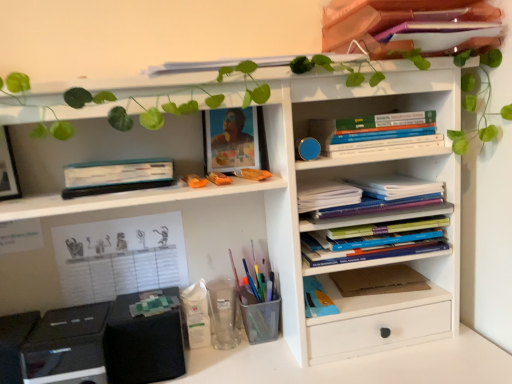
Question: Does matte plastic picture frame at upper center have a greater height compared to transparent plastic cup at lower center, which is the 2th stationery in left-to-right order?

Choices:
 (A) no
 (B) yes

Answer: (B)

Question: Can you confirm if matte plastic picture frame at upper center is smaller than transparent plastic cup at lower center, which is the 2th stationery in left-to-right order?

Choices:
 (A) yes
 (B) no

Answer: (B)

Question: From the image's perspective, is matte plastic picture frame at upper center on transparent plastic cup at lower center, which is the 2th stationery in left-to-right order?

Choices:
 (A) no
 (B) yes

Answer: (B)

Question: From a real-world perspective, is matte plastic picture frame at upper center physically below transparent plastic cup at lower center, which is the 2th stationery in left-to-right order?

Choices:
 (A) yes
 (B) no

Answer: (B)

Question: Is matte plastic picture frame at upper center outside transparent plastic cup at lower center, which is the 2th stationery in left-to-right order?

Choices:
 (A) no
 (B) yes

Answer: (B)

Question: Choose the correct answer: Is hardcover books at center right, the 1th book in the bottom-to-top sequence, inside transparent plastic cup at lower center, which is the 2th stationery from right to left, or outside it?

Choices:
 (A) outside
 (B) inside

Answer: (A)

Question: Does point (399, 206) appear closer or farther from the camera than point (225, 317)?

Choices:
 (A) farther
 (B) closer

Answer: (B)

Question: Considering the relative positions of hardcover books at center right, the 1th book in the bottom-to-top sequence, and transparent plastic cup at lower center, which is the 2th stationery in left-to-right order, in the image provided, is hardcover books at center right, the 1th book in the bottom-to-top sequence, to the left or to the right of transparent plastic cup at lower center, which is the 2th stationery in left-to-right order,?

Choices:
 (A) left
 (B) right

Answer: (B)

Question: From the image's perspective, is hardcover books at center right, the 1th book in the bottom-to-top sequence, above or below transparent plastic cup at lower center, which is the 2th stationery from right to left?

Choices:
 (A) below
 (B) above

Answer: (B)

Question: Is point (176, 266) closer or farther from the camera than point (398, 200)?

Choices:
 (A) closer
 (B) farther

Answer: (B)

Question: Considering their positions, is white paper at left, which is the second paperback book in top-to-bottom order, located in front of or behind white paper notebook at center right, the second book ordered from the bottom?

Choices:
 (A) front
 (B) behind

Answer: (B)

Question: Would you say white paper at left, which appears as the 1th paperback book when viewed from the left, is inside or outside white paper notebook at center right, the second book ordered from the bottom?

Choices:
 (A) outside
 (B) inside

Answer: (A)

Question: From a real-world perspective, is white paper at left, which is the second paperback book in top-to-bottom order, physically located above or below white paper notebook at center right, the second book ordered from the bottom?

Choices:
 (A) above
 (B) below

Answer: (B)

Question: Would you say metal mesh pen holder at lower center, which is the third stationery in left-to-right order, is to the left or to the right of matte pink book at upper right, which appears as the first book when viewed from the top, in the picture?

Choices:
 (A) left
 (B) right

Answer: (A)

Question: Is metal mesh pen holder at lower center, the first stationery from the right, inside or outside of matte pink book at upper right, marked as the 4th book in a bottom-to-top arrangement?

Choices:
 (A) inside
 (B) outside

Answer: (B)